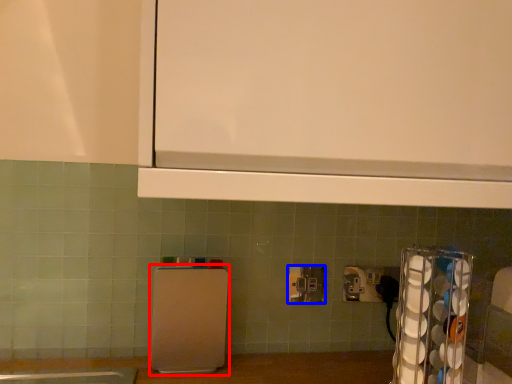
Question: Which point is closer to the camera, appliance (highlighted by a red box) or power plugs and sockets (highlighted by a blue box)?

Choices:
 (A) appliance
 (B) power plugs and sockets

Answer: (A)